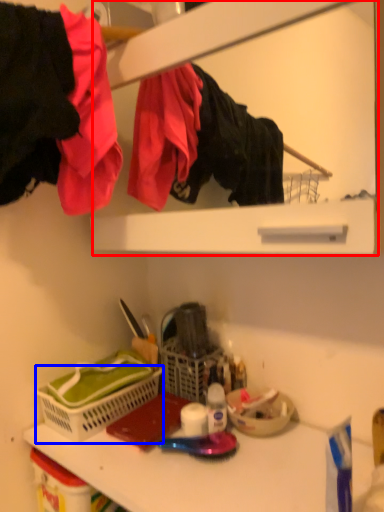
Question: Among these objects, which one is farthest to the camera, medicine cabinet (highlighted by a red box) or basket (highlighted by a blue box)?

Choices:
 (A) medicine cabinet
 (B) basket

Answer: (B)